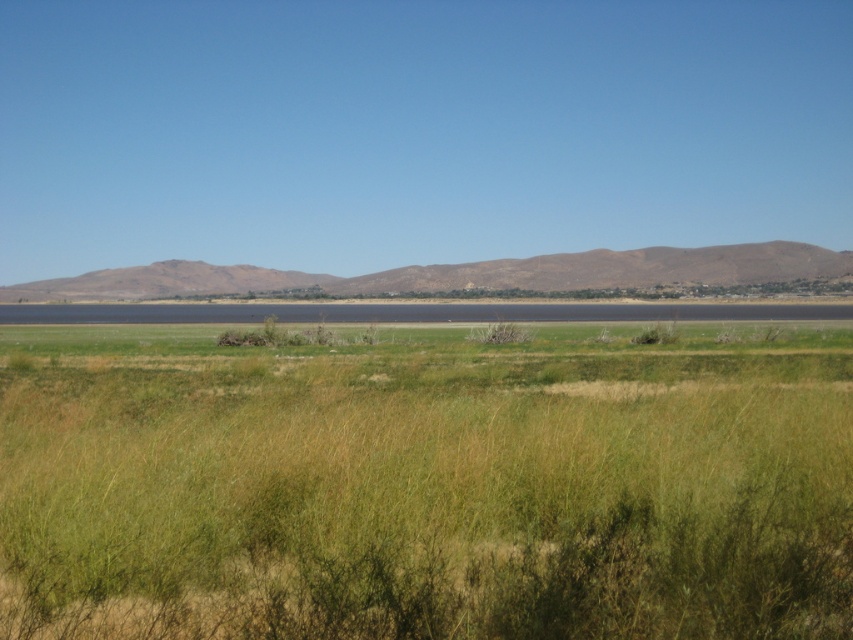
From the picture: Between green grassy at center and brown/dry soil at center, which one appears on the left side from the viewer's perspective?

brown/dry soil at center is more to the left.

Can you confirm if green grassy at center is positioned above brown/dry soil at center?

No, green grassy at center is not above brown/dry soil at center.

Which is in front, point (431, 614) or point (91, 284)?

Point (431, 614) is more forward.

Identify the location of green grassy at center. (424, 484).